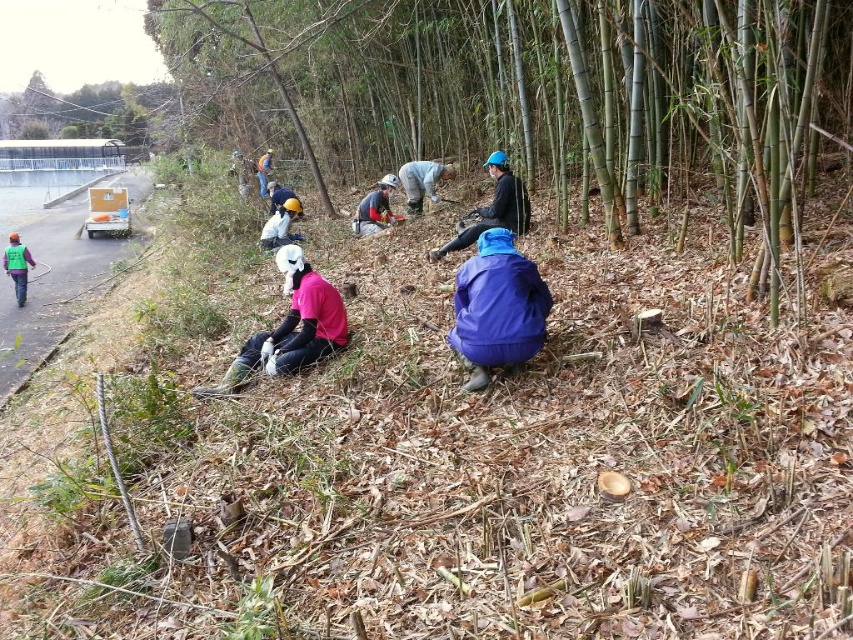
Question: Estimate the real-world distances between objects in this image. Which object is closer to the blue matte jacket at center?

Choices:
 (A) green bamboo at center
 (B) matte black jacket at center

Answer: (B)

Question: Does green bamboo at center appear on the left side of pink matte shirt at center?

Choices:
 (A) yes
 (B) no

Answer: (A)

Question: Which of the following is the farthest from the observer?

Choices:
 (A) blue matte jacket at center
 (B) green bamboo at center

Answer: (A)

Question: Considering the real-world distances, which object is closest to the matte green vest at left?

Choices:
 (A) white matte helmet at center
 (B) blue matte jacket at center
 (C) matte black jacket at center

Answer: (A)

Question: Does green bamboo at center appear on the right side of matte black jacket at center?

Choices:
 (A) yes
 (B) no

Answer: (B)

Question: Does pink matte shirt at center come behind white plastic bag at center?

Choices:
 (A) no
 (B) yes

Answer: (A)